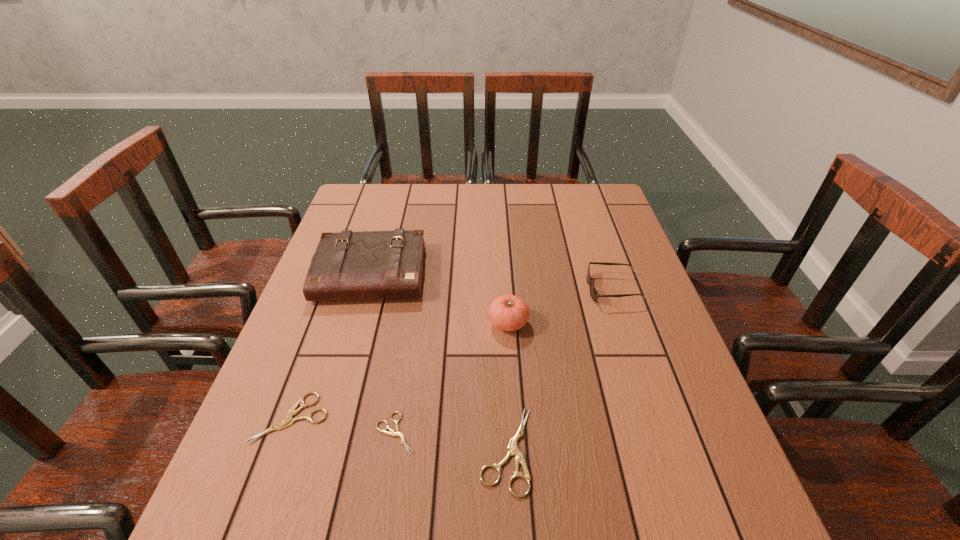
Where is `free point that satisfies the following two spatial constraints: 1. on the lenses of the sunglasses; 2. on the front side of the shortest shears`? free point that satisfies the following two spatial constraints: 1. on the lenses of the sunglasses; 2. on the front side of the shortest shears is located at coordinates click(662, 434).

Identify the location of vacant space that satisfies the following two spatial constraints: 1. on the lenses of the rightmost object; 2. on the front side of the rightmost shears. (668, 450).